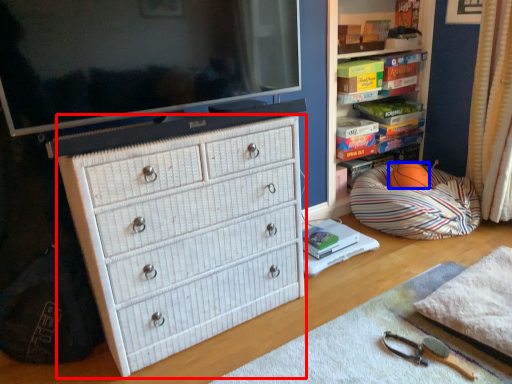
Question: Which of the following is the closest to the observer, chest of drawers (highlighted by a red box) or ball (highlighted by a blue box)?

Choices:
 (A) chest of drawers
 (B) ball

Answer: (A)